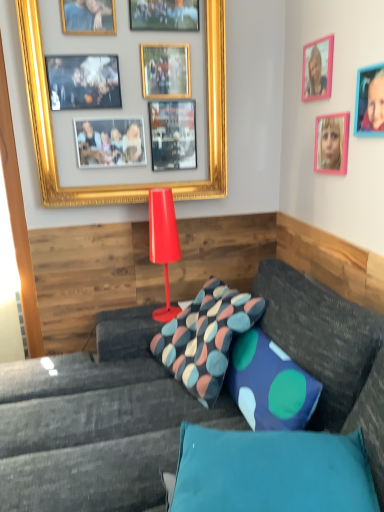
Question: Do you think multicolored fabric pillow at center, the 2th pillow when ordered from front to back, is within pink plastic picture frame at upper right, which is counted as the 1th picture frame, starting from the right, or outside of it?

Choices:
 (A) inside
 (B) outside

Answer: (B)

Question: From the image's perspective, is multicolored fabric pillow at center, the first pillow viewed from the back, above or below pink plastic picture frame at upper right, positioned as the 4th picture frame in left-to-right order?

Choices:
 (A) above
 (B) below

Answer: (B)

Question: Which object is the farthest from the multicolored fabric pillow at center, the first pillow viewed from the back?

Choices:
 (A) textured gray couch at center
 (B) pink plastic picture frame at upper right, which ranks as the 2th picture frame in left-to-right order
 (C) pink plastic picture frame at upper right, positioned as the 4th picture frame in left-to-right order
 (D) teal fabric pillow at lower center, the 1th pillow in the front-to-back sequence
 (E) shiny red lamp at center

Answer: (B)

Question: Estimate the real-world distances between objects in this image. Which object is farther from the multicolored fabric pillow at center, the 2th pillow when ordered from front to back?

Choices:
 (A) pink plastic picture frame at upper right, acting as the third picture frame starting from the left
 (B) gold/gilded picture frame at upper left, which appears as the fourth picture frame when viewed from the right
 (C) pink plastic picture frame at upper right, which ranks as the 2th picture frame in left-to-right order
 (D) teal fabric pillow at lower center, the 1th pillow in the front-to-back sequence
 (E) shiny red lamp at center

Answer: (C)